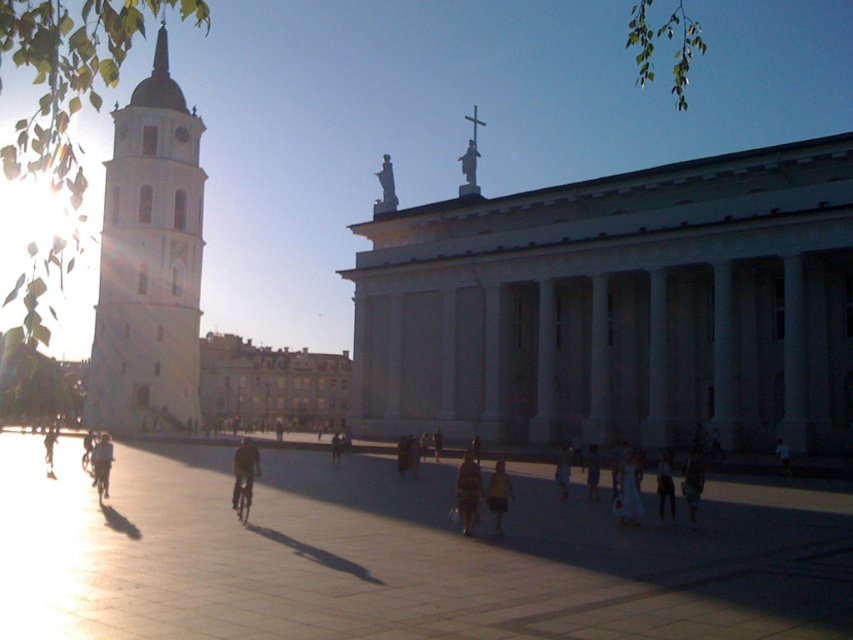
You are standing in the center of the scene and see the white dress at center and the metallic silver bicycle at center. Which object is closer to you?

The white dress at center is closer to you since it is in front of the metallic silver bicycle at center.

You are standing in front of the grand classical building with columns and a flat roof. You notice two points marked in the scene. The first point is at coordinates point [99,289] and the second is at point [457,483]. If you were to walk towards the building, which point would appear closer to you?

Point [99,289] is further to the camera than point [457,483], so the first point would appear closer to you as you walk towards the building.

You are a photographer standing at the base of the white stone tower at left. You want to take a photo of the striped fabric dress at center without any obstructions. Given that the tower is 30 meters tall and your camera has a maximum zoom range of 100 meters, can you capture the dress clearly from your current position?

The distance between the white stone tower at left and the striped fabric dress at center is 56.25 meters. Since your camera can zoom up to 100 meters, you can capture the striped fabric dress at center clearly from your current position at the base of the white stone tower at left without any issues.